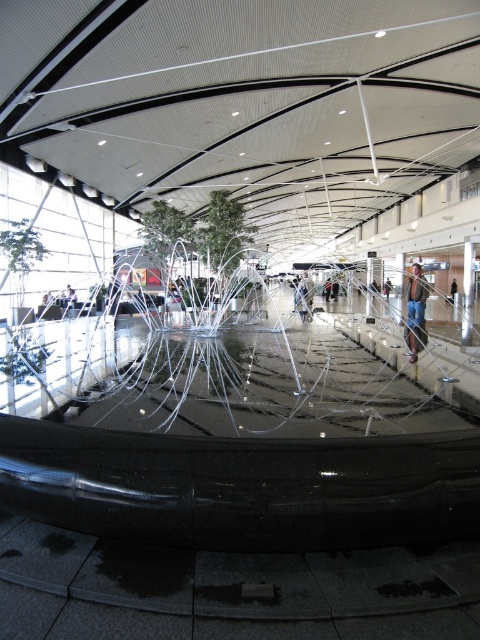
Does metallic silver person at center appear on the right side of denim jacket at center?

In fact, metallic silver person at center is to the left of denim jacket at center.

Who is more distant from viewer, (299, 301) or (451, 298)?

Point (451, 298)

Between point (301, 296) and point (454, 285), which one is positioned in front?

Point (301, 296) is more forward.

Locate an element on the screen. metallic silver person at center is located at coordinates (303, 298).

Does blue jeans at center have a greater width compared to denim jacket at center?

Yes.

Based on the photo, can you confirm if blue jeans at center is positioned below denim jacket at center?

Indeed, blue jeans at center is positioned under denim jacket at center.

Identify the location of blue jeans at center. (416, 312).

Who is higher up, blue jeans at center or metallic silver person at center?

blue jeans at center

Can you confirm if blue jeans at center is positioned below metallic silver person at center?

No, blue jeans at center is not below metallic silver person at center.

Is point (422, 346) more distant than point (300, 278)?

No, it is not.

Find the location of `blue jeans at center`. blue jeans at center is located at coordinates (416, 312).